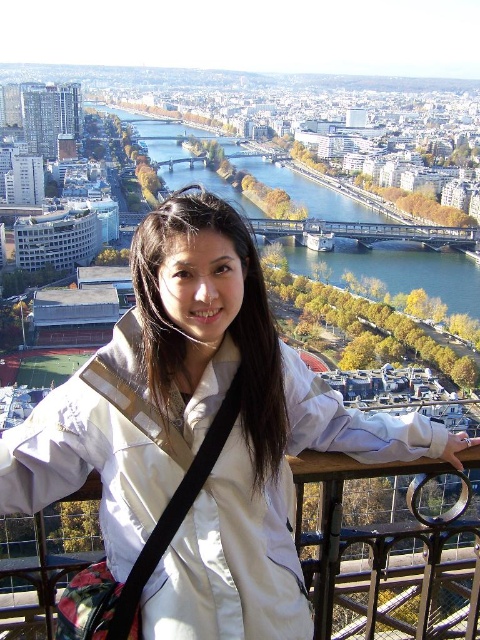
Can you confirm if white fabric jacket at center is bigger than green water at center?

Actually, white fabric jacket at center might be smaller than green water at center.

Which is above, white fabric jacket at center or green water at center?

green water at center

Where is `white fabric jacket at center`? white fabric jacket at center is located at coordinates (199, 436).

Where is `white fabric jacket at center`? Image resolution: width=480 pixels, height=640 pixels. white fabric jacket at center is located at coordinates (199, 436).